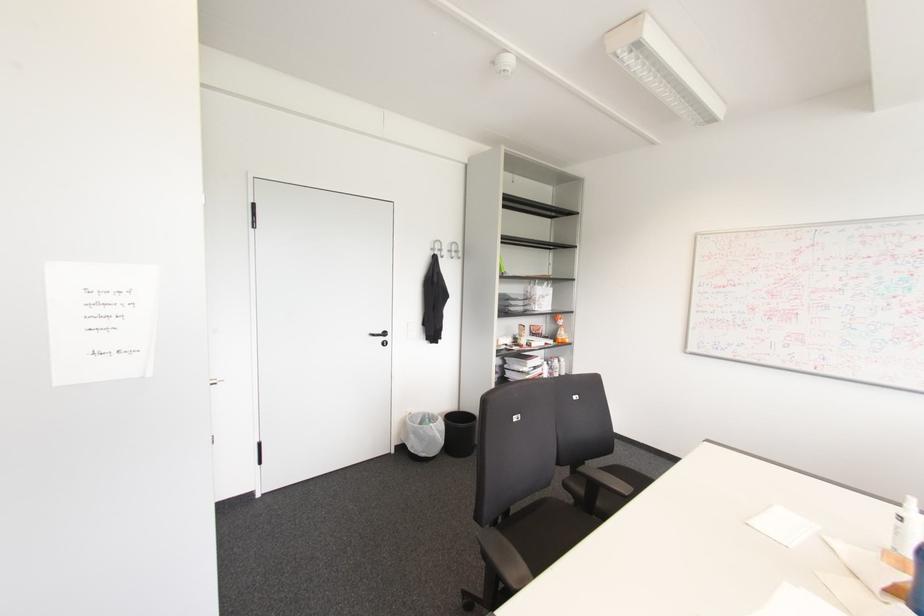
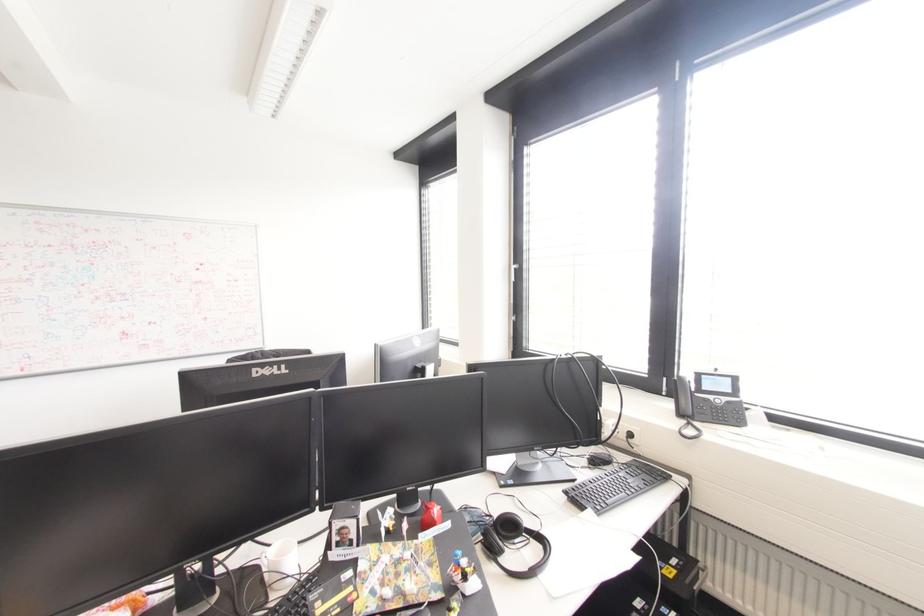
Question: Based on the continuous images, in which direction is the camera rotating? Reply with the corresponding letter.

Choices:
 (A) Left
 (B) Right
 (C) Up
 (D) Down

Answer: (B)